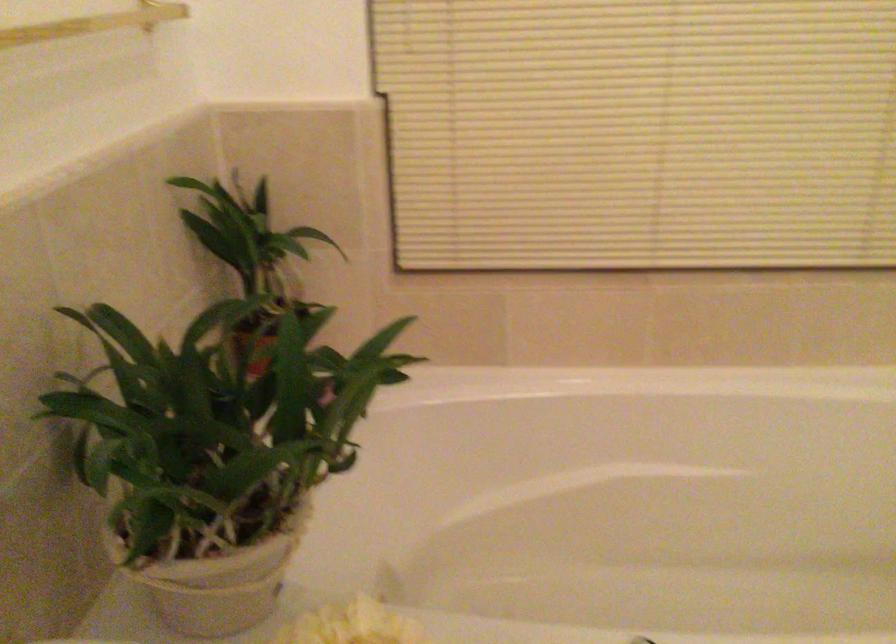
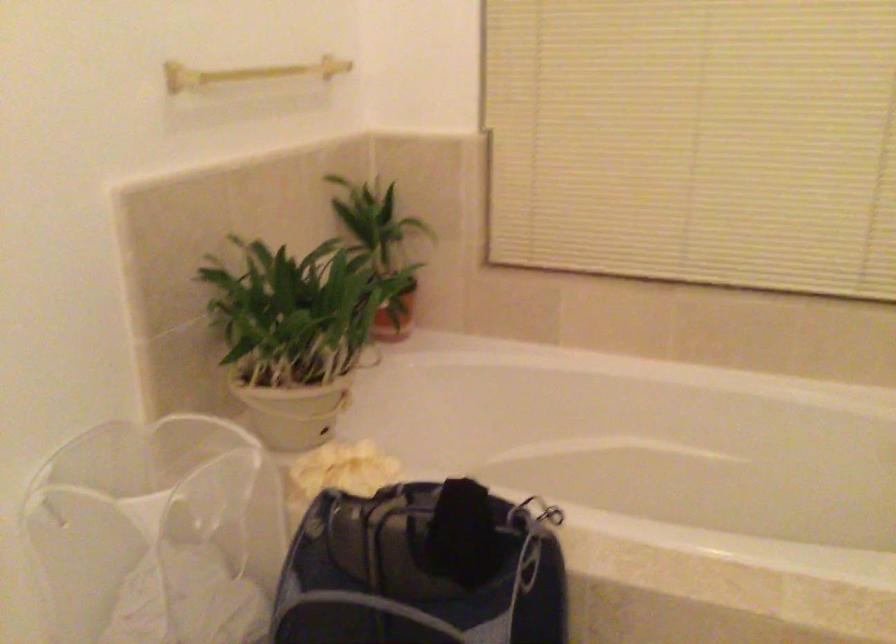
In a continuous first-person perspective shot, in which direction is the camera moving?

The movement direction of the cameraman is right, backward.